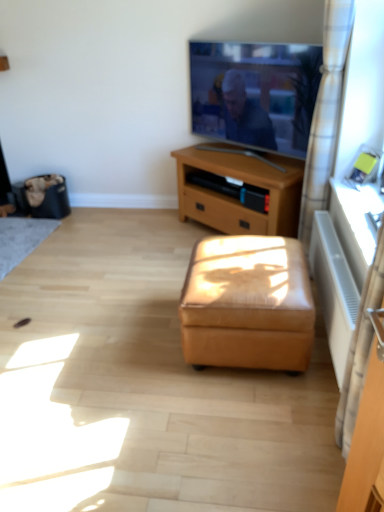
Identify the location of free space that is in between brown wooden tv stand at center and black fabric trash bin at left. The height and width of the screenshot is (512, 384). (137, 222).